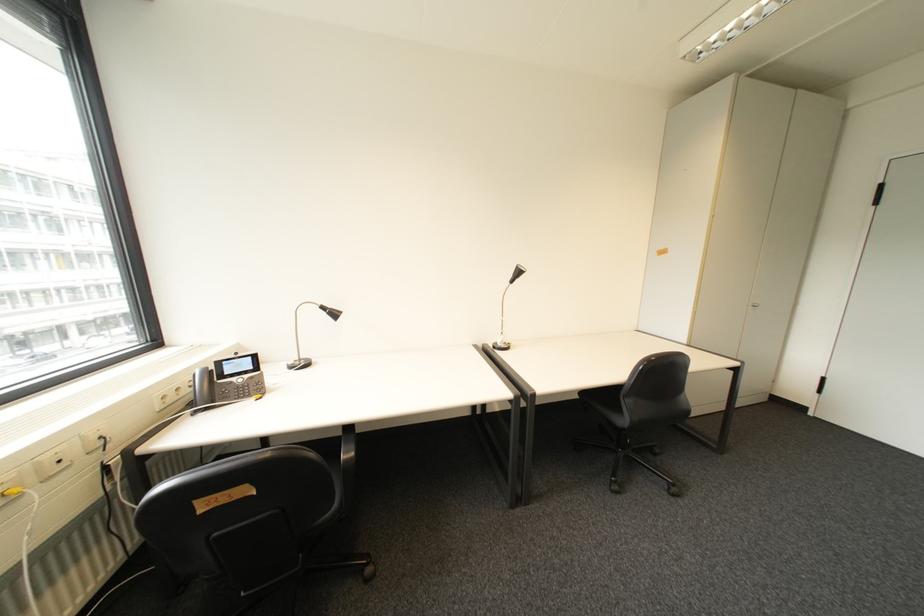
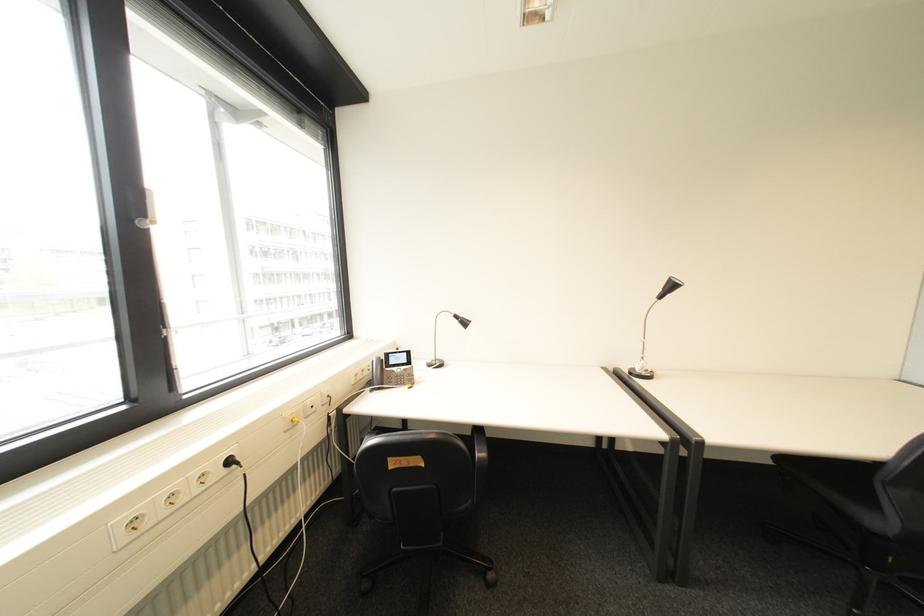
Locate, in the second image, the point that corresponds to point 524,275 in the first image.

(673, 290)